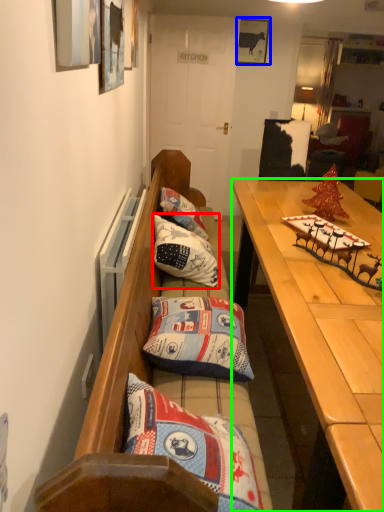
Question: Estimate the real-world distances between objects in this image. Which object is farther from pillow (highlighted by a red box), picture frame (highlighted by a blue box) or desk (highlighted by a green box)?

Choices:
 (A) picture frame
 (B) desk

Answer: (A)